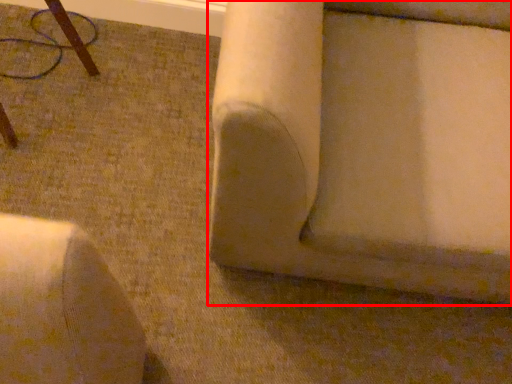
Question: From the image's perspective, where is furniture (annotated by the red box) located relative to furniture?

Choices:
 (A) above
 (B) below

Answer: (B)